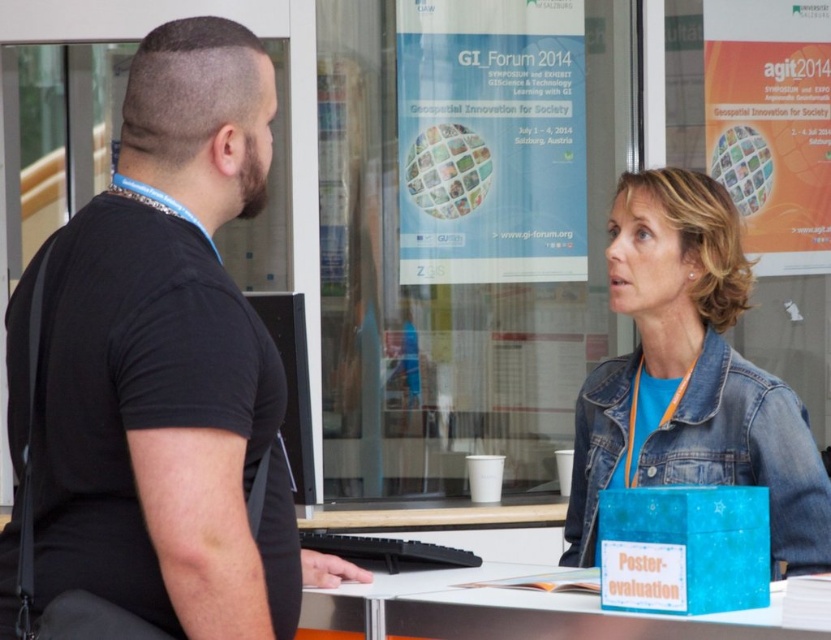
You are standing in the conference room and need to place a small notebook on the blue plastic table at lower center. However, there is a black matte shirt at left in the way. Can you still place the notebook on the table without moving the shirt?

The black matte shirt at left is above the blue plastic table at lower center, so the shirt is positioned higher up and not blocking the table. Therefore, you can place the notebook on the blue plastic table at lower center without moving the shirt.

You are organizing a clothing donation drive and need to decide which items can fit into a narrow donation box. The black matte shirt at left and the denim jacket at lower right are both candidates. Based on their sizes, which one is more likely to fit into the narrow box?

The black matte shirt at left is thinner than the denim jacket at lower right, so it is more likely to fit into the narrow donation box.